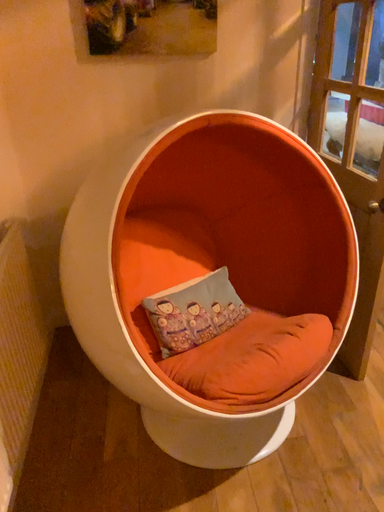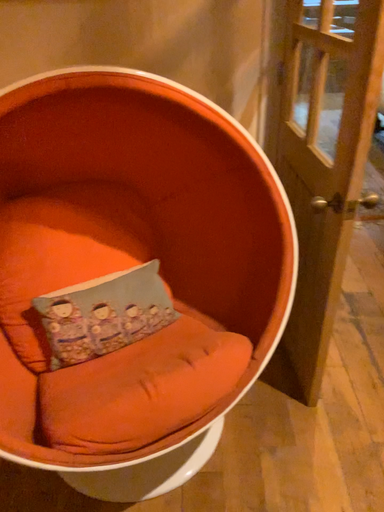
Question: How did the camera likely rotate when shooting the video?

Choices:
 (A) rotated right
 (B) rotated left

Answer: (B)